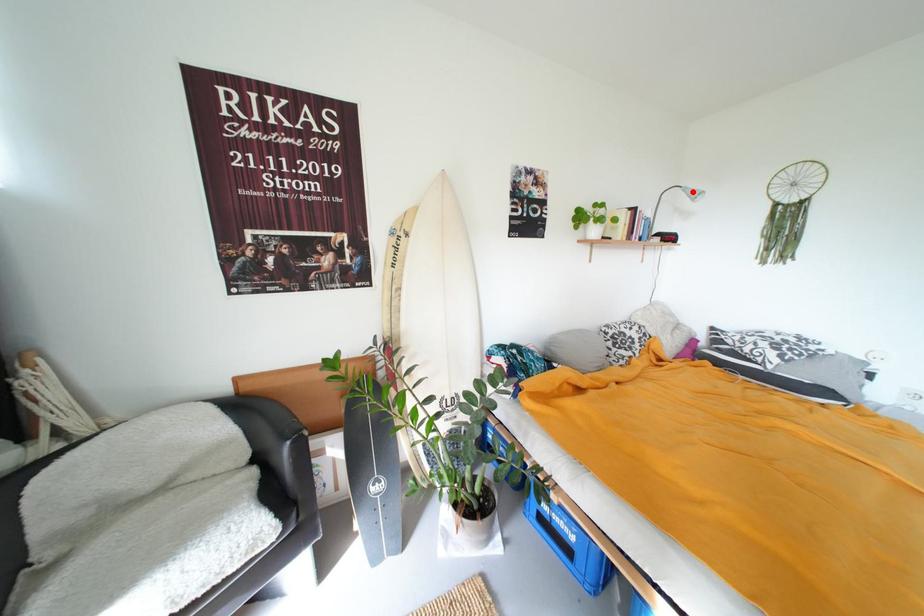
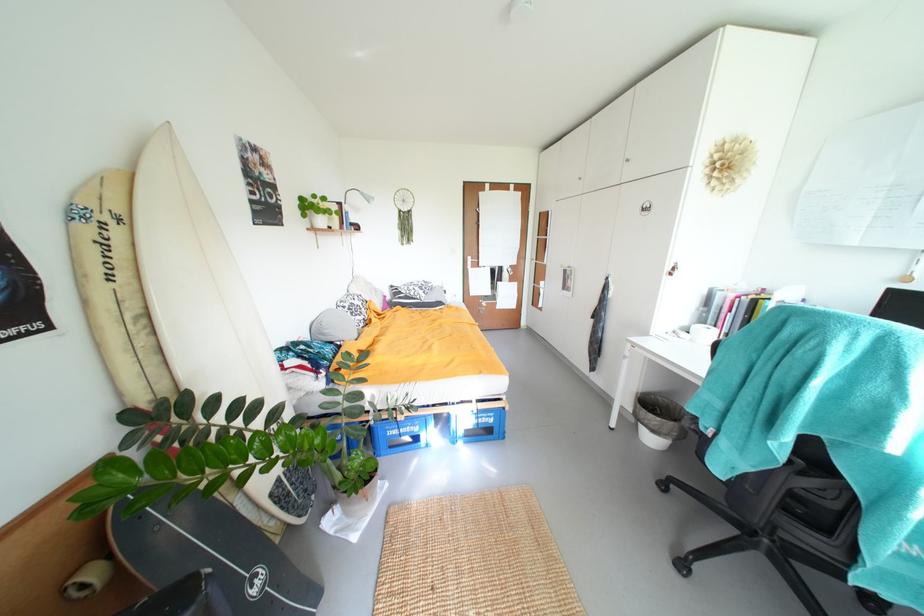
Question: I am providing you with two images of the same scene from different viewpoints. In image1, a red point is highlighted. Considering the same 3D point in image2, which of the following is correct?

Choices:
 (A) It is closer
 (B) It is farther

Answer: (A)